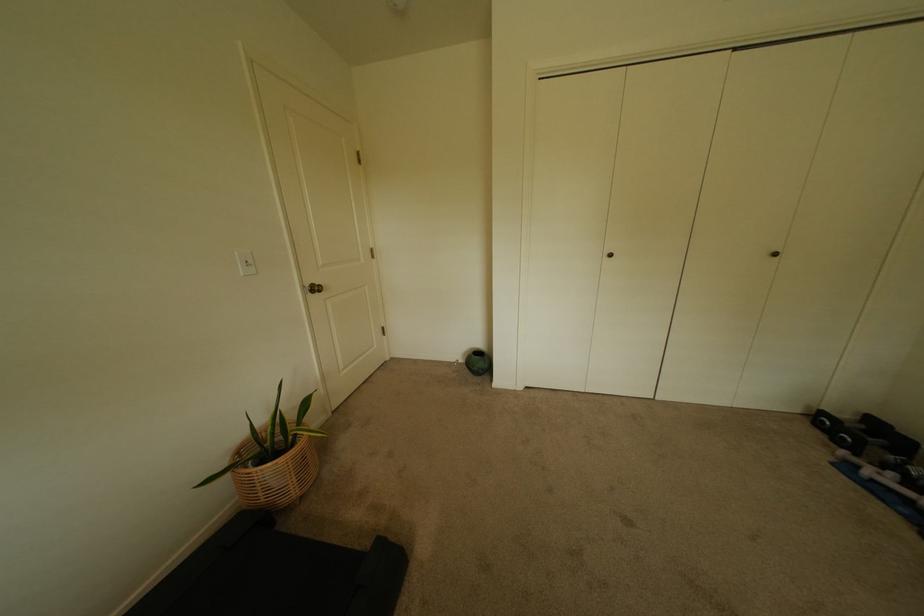
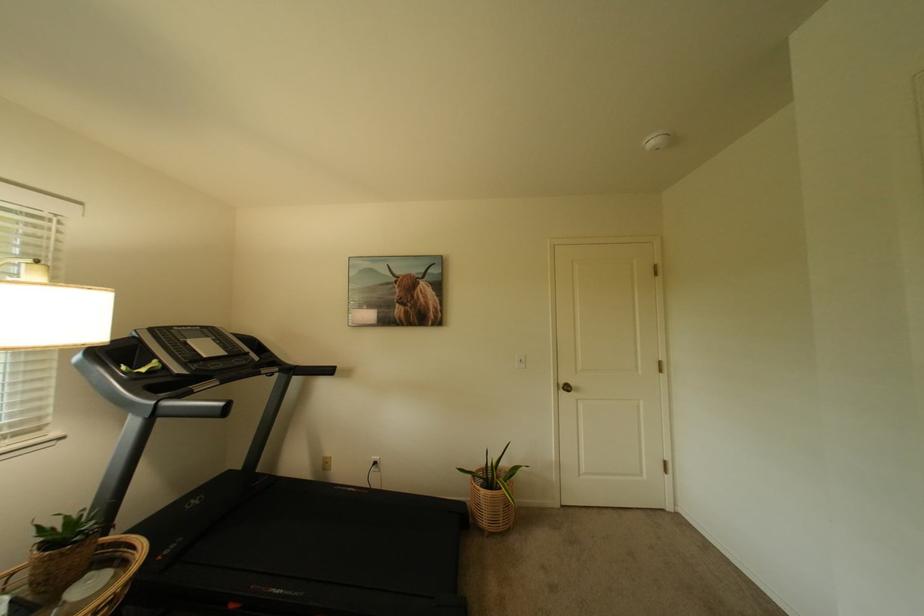
Find the pixel in the second image that matches (302,480) in the first image.

(495, 515)